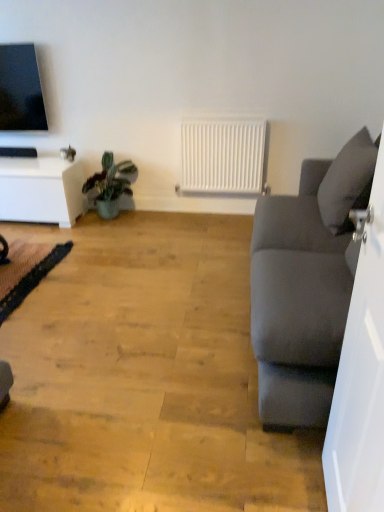
Question: Considering the relative sizes of white matte radiator at center and white glossy table at left in the image provided, is white matte radiator at center thinner than white glossy table at left?

Choices:
 (A) yes
 (B) no

Answer: (A)

Question: Is white matte radiator at center oriented away from white glossy table at left?

Choices:
 (A) yes
 (B) no

Answer: (B)

Question: Is white glossy table at left located within white matte radiator at center?

Choices:
 (A) yes
 (B) no

Answer: (B)

Question: From the image's perspective, is white matte radiator at center beneath white glossy table at left?

Choices:
 (A) no
 (B) yes

Answer: (A)

Question: Is white matte radiator at center taller than white glossy table at left?

Choices:
 (A) no
 (B) yes

Answer: (B)

Question: Can you confirm if white matte radiator at center is positioned to the right of white glossy table at left?

Choices:
 (A) yes
 (B) no

Answer: (A)

Question: Does gray fabric pillow at right touch green matte plant at lower left?

Choices:
 (A) yes
 (B) no

Answer: (B)

Question: From a real-world perspective, is gray fabric pillow at right on green matte plant at lower left?

Choices:
 (A) yes
 (B) no

Answer: (A)

Question: Does gray fabric pillow at right appear on the right side of green matte plant at lower left?

Choices:
 (A) yes
 (B) no

Answer: (A)

Question: From the image's perspective, would you say gray fabric pillow at right is positioned over green matte plant at lower left?

Choices:
 (A) no
 (B) yes

Answer: (A)

Question: Is gray fabric pillow at right in front of green matte plant at lower left?

Choices:
 (A) yes
 (B) no

Answer: (A)

Question: Is gray fabric pillow at right shorter than green matte plant at lower left?

Choices:
 (A) yes
 (B) no

Answer: (B)

Question: Is black lace yoga mat at lower left not close to gray fabric pillow at right?

Choices:
 (A) no
 (B) yes

Answer: (B)